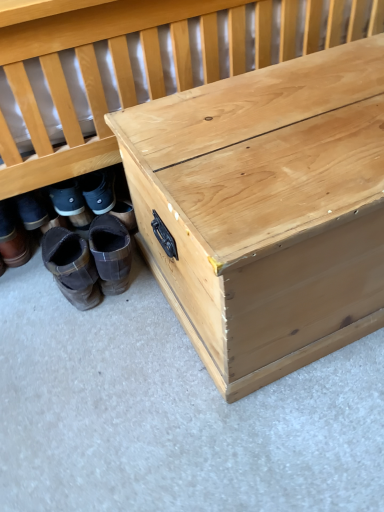
Question: From the image's perspective, is natural wood trunk at center located above or below natural wood trunk at lower right?

Choices:
 (A) below
 (B) above

Answer: (A)

Question: From a real-world perspective, is natural wood trunk at center physically located above or below natural wood trunk at lower right?

Choices:
 (A) below
 (B) above

Answer: (A)

Question: Which of these objects is positioned closest to the brown suede boots at lower left, which ranks as the first footwear in right-to-left order?

Choices:
 (A) brown suede boots at lower left, the 2th footwear viewed from the right
 (B) brown suede boots at lower left, the first footwear from the left
 (C) natural wood trunk at lower right
 (D) natural wood trunk at center

Answer: (A)

Question: Considering the real-world distances, which object is farthest from the natural wood trunk at center?

Choices:
 (A) brown suede boots at lower left, the 2th footwear viewed from the right
 (B) brown suede boots at lower left, the first footwear from the left
 (C) natural wood trunk at lower right
 (D) brown suede boots at lower left, the 3th footwear in the left-to-right sequence

Answer: (B)